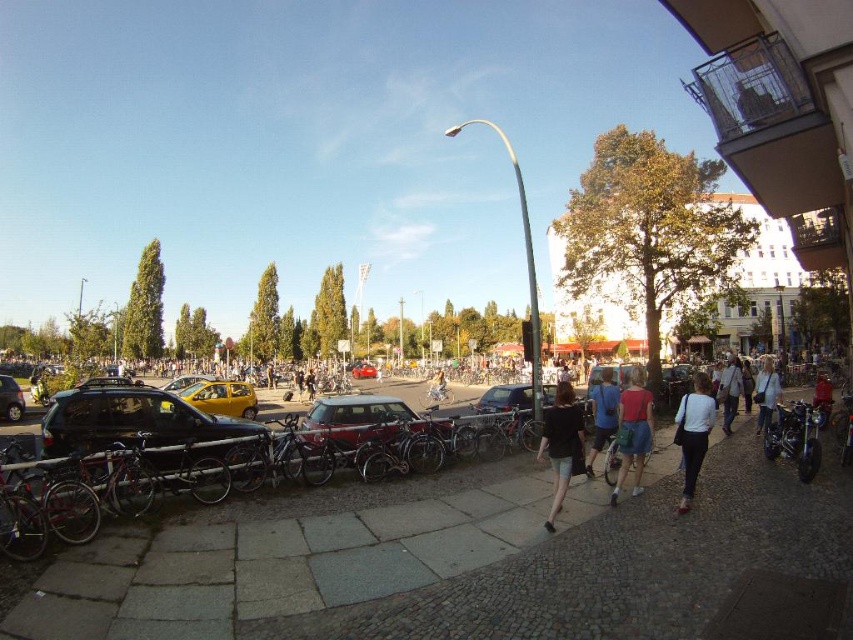
Measure the distance between shiny metallic bicycle at lower left and camera.

shiny metallic bicycle at lower left is 6.30 meters from camera.

Is shiny metallic bicycle at lower left taller than matte black bicycle at center?

In fact, shiny metallic bicycle at lower left may be shorter than matte black bicycle at center.

Find the location of a particular element. The height and width of the screenshot is (640, 853). shiny metallic bicycle at lower left is located at coordinates (42, 508).

Is point (132, 596) closer to viewer compared to point (766, 410)?

Yes.

Does cobblestone pavement at center have a greater width compared to white cotton shirt at lower right?

Incorrect, cobblestone pavement at center's width does not surpass white cotton shirt at lower right's.

The image size is (853, 640). What do you see at coordinates (473, 563) in the screenshot?
I see `cobblestone pavement at center` at bounding box center [473, 563].

Locate an element on the screen. cobblestone pavement at center is located at coordinates (473, 563).

Can you confirm if yellow matte car at center is taller than denim jacket at lower right?

Incorrect, yellow matte car at center's height is not larger of denim jacket at lower right's.

Can you confirm if yellow matte car at center is positioned above denim jacket at lower right?

Actually, yellow matte car at center is below denim jacket at lower right.

Is point (218, 396) closer to camera compared to point (735, 397)?

No, (218, 396) is further to viewer.

The height and width of the screenshot is (640, 853). Identify the location of yellow matte car at center. (219, 397).